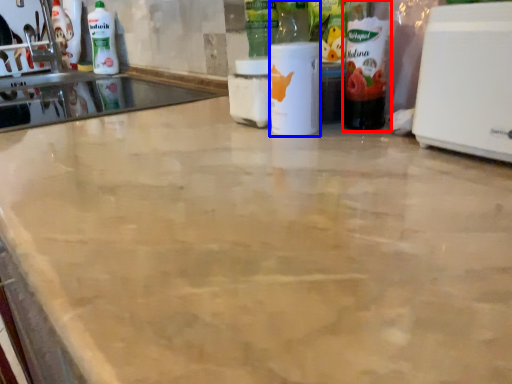
Question: Among these objects, which one is farthest to the camera, bottle (highlighted by a red box) or bottle (highlighted by a blue box)?

Choices:
 (A) bottle
 (B) bottle

Answer: (B)